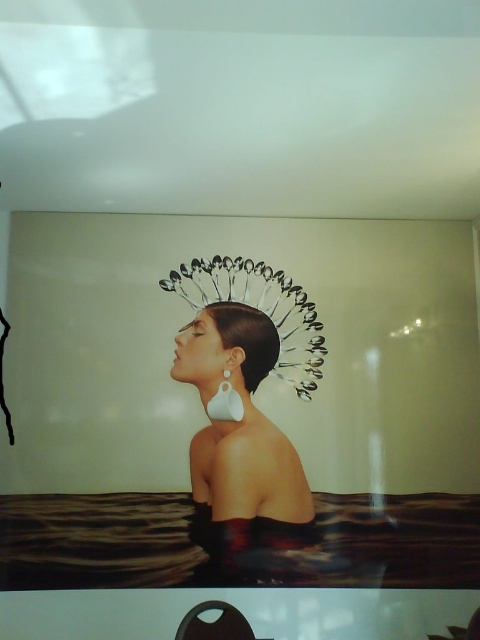
Question: Is white matte crown at center positioned before white matte earring at center?

Choices:
 (A) no
 (B) yes

Answer: (B)

Question: From the image, what is the correct spatial relationship of white matte crown at center in relation to sleek black hair at center?

Choices:
 (A) above
 (B) below

Answer: (B)

Question: Is white matte crown at center thinner than sleek black hair at center?

Choices:
 (A) no
 (B) yes

Answer: (A)

Question: Based on their relative distances, which object is nearer to the white matte crown at center?

Choices:
 (A) white matte earring at center
 (B) silver metallic spoons at upper center

Answer: (B)

Question: Which point is farther to the camera?

Choices:
 (A) white matte crown at center
 (B) silver metallic spoons at upper center
 (C) white matte earring at center
 (D) sleek black hair at center

Answer: (B)

Question: Estimate the real-world distances between objects in this image. Which object is farther from the silver metallic spoons at upper center?

Choices:
 (A) white matte crown at center
 (B) sleek black hair at center
 (C) white matte earring at center

Answer: (C)